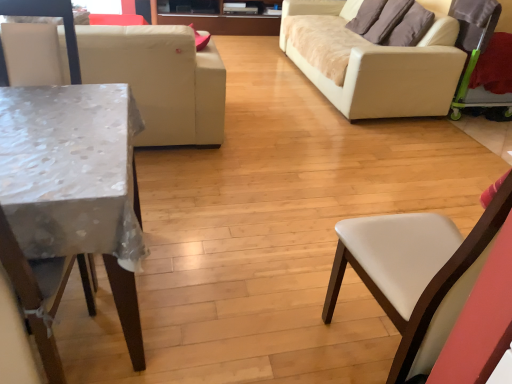
Measure the distance between point (298, 5) and camera.

Point (298, 5) and camera are 15.70 feet apart.

You are a GUI agent. You are given a task and a screenshot of the screen. Output one action in this format:
    pyautogui.click(x=<x>, y=<y>)
    Task: Click on the white leather couch at left, the first studio couch from the left
    The height and width of the screenshot is (384, 512).
    Given the screenshot: What is the action you would take?
    coord(160,80)

I want to click on white leather chair at right, the second chair from the left, so click(417, 273).

What are the coordinates of `green plastic swivel chair at right` in the screenshot? It's located at (474, 46).

The width and height of the screenshot is (512, 384). Find the location of `beige fabric studio couch at right, placed as the 1th studio couch when sorted from right to left`. beige fabric studio couch at right, placed as the 1th studio couch when sorted from right to left is located at coordinates (382, 67).

Is white leather chair at left, marked as the 2th chair in a right-to-left arrangement, completely or partially inside wooden entertainment center at upper center?

Actually, white leather chair at left, marked as the 2th chair in a right-to-left arrangement, is outside wooden entertainment center at upper center.

Is wooden entertainment center at upper center facing towards white leather chair at left, marked as the 2th chair in a right-to-left arrangement?

Yes, wooden entertainment center at upper center is oriented towards white leather chair at left, marked as the 2th chair in a right-to-left arrangement.

You are a GUI agent. You are given a task and a screenshot of the screen. Output one action in this format:
    pyautogui.click(x=<x>, y=<y>)
    Task: Click on the entertainment center on the right of white leather chair at left, marked as the 2th chair in a right-to-left arrangement
    The width and height of the screenshot is (512, 384).
    Given the screenshot: What is the action you would take?
    pyautogui.click(x=219, y=20)

Is wooden entertainment center at upper center further to the viewer compared to white leather chair at left, arranged as the first chair when viewed from the left?

Yes, it is behind white leather chair at left, arranged as the first chair when viewed from the left.

Is point (451, 324) positioned behind point (399, 64)?

No.

In the scene shown: Is beige fabric studio couch at right, the 2th studio couch in the left-to-right sequence, inside white leather chair at right, the second chair from the left?

Definitely not — beige fabric studio couch at right, the 2th studio couch in the left-to-right sequence, is not inside white leather chair at right, the second chair from the left.

Which object is wider, white leather chair at right, the second chair from the left, or beige fabric studio couch at right, placed as the 1th studio couch when sorted from right to left?

beige fabric studio couch at right, placed as the 1th studio couch when sorted from right to left.

From a real-world perspective, is white leather chair at right, which is the 1th chair in right-to-left order, located beneath beige fabric studio couch at right, the 2th studio couch in the left-to-right sequence?

No, from a real-world perspective, white leather chair at right, which is the 1th chair in right-to-left order, is not below beige fabric studio couch at right, the 2th studio couch in the left-to-right sequence.

Which of these two, white leather couch at left, placed as the 2th studio couch when sorted from right to left, or brown fabric pillow at upper right, which is the first pillow in back-to-front order, is wider?

white leather couch at left, placed as the 2th studio couch when sorted from right to left, is wider.

Based on their positions, is white leather couch at left, the first studio couch from the left, located to the left or right of brown fabric pillow at upper right, which is the first pillow in back-to-front order?

Based on their positions, white leather couch at left, the first studio couch from the left, is located to the left of brown fabric pillow at upper right, which is the first pillow in back-to-front order.

Is brown fabric pillow at upper right, positioned as the second pillow in front-to-back order, at the back of white leather couch at left, placed as the 2th studio couch when sorted from right to left?

No, white leather couch at left, placed as the 2th studio couch when sorted from right to left, is not facing the opposite direction of brown fabric pillow at upper right, positioned as the second pillow in front-to-back order.

Where is `the 2nd studio couch to the left of the brown fabric pillow at upper right, which is the first pillow in back-to-front order, starting your count from the anchor`? The height and width of the screenshot is (384, 512). the 2nd studio couch to the left of the brown fabric pillow at upper right, which is the first pillow in back-to-front order, starting your count from the anchor is located at coordinates (160, 80).

Is white leather chair at right, which is the 1th chair in right-to-left order, looking in the opposite direction of brown fabric pillow at upper right, which is counted as the 2th pillow, starting from the back?

white leather chair at right, which is the 1th chair in right-to-left order, does not have its back to brown fabric pillow at upper right, which is counted as the 2th pillow, starting from the back.

Considering the positions of point (508, 205) and point (422, 29), is point (508, 205) closer or farther from the camera than point (422, 29)?

Point (508, 205) appears to be closer to the viewer than point (422, 29).

Looking at this image, from a real-world perspective, which is physically below, white leather chair at right, the second chair from the left, or brown fabric pillow at upper right, acting as the first pillow starting from the front?

white leather chair at right, the second chair from the left.

How distant is white leather chair at right, which is the 1th chair in right-to-left order, from brown fabric pillow at upper right, which is counted as the 2th pillow, starting from the back?

white leather chair at right, which is the 1th chair in right-to-left order, and brown fabric pillow at upper right, which is counted as the 2th pillow, starting from the back, are 2.58 meters apart.

Identify the location of table that appears on the left of green plastic swivel chair at right. This screenshot has height=384, width=512. (75, 182).

Is green plastic swivel chair at right surrounded by metallic silver table at left?

No, green plastic swivel chair at right is not a part of metallic silver table at left.

Is metallic silver table at left taller or shorter than green plastic swivel chair at right?

metallic silver table at left is shorter than green plastic swivel chair at right.

Is point (139, 336) positioned before point (466, 102)?

Yes, point (139, 336) is in front of point (466, 102).

From the image's perspective, is brown fabric pillow at upper right, which is the first pillow in back-to-front order, located above or below metallic silver table at left?

Based on their image positions, brown fabric pillow at upper right, which is the first pillow in back-to-front order, is located above metallic silver table at left.

Would you consider brown fabric pillow at upper right, which is the first pillow in back-to-front order, to be distant from metallic silver table at left?

Yes.

Does brown fabric pillow at upper right, which is the first pillow in back-to-front order, have a greater width compared to metallic silver table at left?

No.

Which object is more forward, brown fabric pillow at upper right, which is the first pillow in back-to-front order, or metallic silver table at left?

Positioned in front is metallic silver table at left.

Where is `table in front of the wooden entertainment center at upper center`? Image resolution: width=512 pixels, height=384 pixels. table in front of the wooden entertainment center at upper center is located at coordinates (75, 182).

From the image's perspective, who appears lower, wooden entertainment center at upper center or metallic silver table at left?

metallic silver table at left, from the image's perspective.

From the picture: Is the surface of wooden entertainment center at upper center in direct contact with metallic silver table at left?

No.

Is point (256, 24) farther from viewer compared to point (10, 127)?

Yes, it is behind point (10, 127).

Locate an element on the screen. entertainment center that appears above the white leather chair at left, arranged as the first chair when viewed from the left (from the image's perspective) is located at coordinates (219, 20).

What are the coordinates of `the 2nd studio couch behind the white leather chair at right, which is the 1th chair in right-to-left order` in the screenshot? It's located at (382, 67).

Considering their positions, is brown fabric pillow at upper right, which is the first pillow in back-to-front order, positioned further to brown fabric pillow at upper right, which is counted as the 2th pillow, starting from the back, than wooden entertainment center at upper center?

The object further to brown fabric pillow at upper right, which is counted as the 2th pillow, starting from the back, is wooden entertainment center at upper center.

Looking at the image, which one is located closer to wooden entertainment center at upper center, metallic silver table at left or brown fabric pillow at upper right, which is counted as the 2th pillow, starting from the back?

brown fabric pillow at upper right, which is counted as the 2th pillow, starting from the back.

Which object lies further to the anchor point metallic silver table at left, green plastic swivel chair at right or white leather chair at right, which is the 1th chair in right-to-left order?

green plastic swivel chair at right lies further to metallic silver table at left than the other object.

Considering their positions, is metallic silver table at left positioned further to white leather couch at left, placed as the 2th studio couch when sorted from right to left, than wooden entertainment center at upper center?

wooden entertainment center at upper center.

From the image, which object appears to be nearer to white leather chair at left, arranged as the first chair when viewed from the left, white leather couch at left, placed as the 2th studio couch when sorted from right to left, or wooden entertainment center at upper center?

Among the two, white leather couch at left, placed as the 2th studio couch when sorted from right to left, is located nearer to white leather chair at left, arranged as the first chair when viewed from the left.

Looking at the image, which one is located further to white leather chair at left, marked as the 2th chair in a right-to-left arrangement, white leather couch at left, the first studio couch from the left, or beige fabric studio couch at right, placed as the 1th studio couch when sorted from right to left?

beige fabric studio couch at right, placed as the 1th studio couch when sorted from right to left, is positioned further to the anchor white leather chair at left, marked as the 2th chair in a right-to-left arrangement.

From the image, which object appears to be nearer to white leather chair at left, marked as the 2th chair in a right-to-left arrangement, brown fabric pillow at upper right, positioned as the second pillow in front-to-back order, or brown fabric pillow at upper right, which is counted as the 2th pillow, starting from the back?

Based on the image, brown fabric pillow at upper right, positioned as the second pillow in front-to-back order, appears to be nearer to white leather chair at left, marked as the 2th chair in a right-to-left arrangement.

Based on their spatial positions, is white leather chair at left, marked as the 2th chair in a right-to-left arrangement, or brown fabric pillow at upper right, which is counted as the 2th pillow, starting from the back, further from white leather couch at left, the first studio couch from the left?

brown fabric pillow at upper right, which is counted as the 2th pillow, starting from the back, lies further to white leather couch at left, the first studio couch from the left, than the other object.

You are a GUI agent. You are given a task and a screenshot of the screen. Output one action in this format:
    pyautogui.click(x=<x>, y=<y>)
    Task: Click on the pillow located between white leather chair at right, which is the 1th chair in right-to-left order, and brown fabric pillow at upper right, which is the first pillow in back-to-front order, in the depth direction
    The width and height of the screenshot is (512, 384).
    Given the screenshot: What is the action you would take?
    pyautogui.click(x=410, y=27)

Locate an element on the screen. pillow between metallic silver table at left and brown fabric pillow at upper right, positioned as the second pillow in front-to-back order, from front to back is located at coordinates (410, 27).

Identify the location of table between white leather chair at right, the second chair from the left, and brown fabric pillow at upper right, which is the first pillow in back-to-front order, in the front-back direction. (75, 182).

You are a GUI agent. You are given a task and a screenshot of the screen. Output one action in this format:
    pyautogui.click(x=<x>, y=<y>)
    Task: Click on the pillow situated between white leather couch at left, placed as the 2th studio couch when sorted from right to left, and brown fabric pillow at upper right, acting as the first pillow starting from the front, from left to right
    
    Given the screenshot: What is the action you would take?
    pyautogui.click(x=387, y=20)